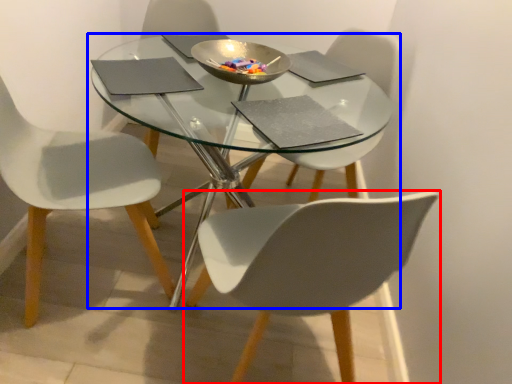
Question: Which object appears farthest to the camera in this image, chair (highlighted by a red box) or coffee table (highlighted by a blue box)?

Choices:
 (A) chair
 (B) coffee table

Answer: (B)